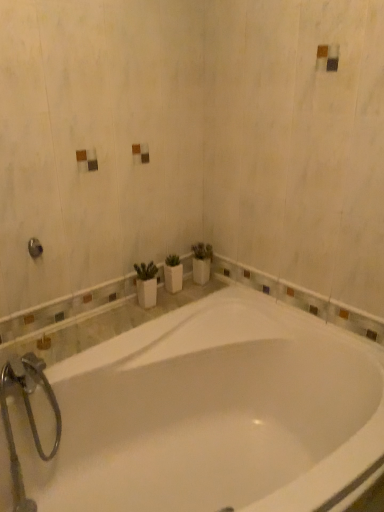
Question: Is white glossy bathtub at center taller than brushed metal shower at upper left?

Choices:
 (A) yes
 (B) no

Answer: (A)

Question: Is white glossy bathtub at center smaller than brushed metal shower at upper left?

Choices:
 (A) no
 (B) yes

Answer: (A)

Question: Is white glossy bathtub at center looking in the opposite direction of brushed metal shower at upper left?

Choices:
 (A) yes
 (B) no

Answer: (B)

Question: Is white glossy bathtub at center closer to the viewer compared to brushed metal shower at upper left?

Choices:
 (A) no
 (B) yes

Answer: (B)

Question: Does white glossy bathtub at center have a greater width compared to brushed metal shower at upper left?

Choices:
 (A) yes
 (B) no

Answer: (A)

Question: From a real-world perspective, is white glossy bathtub at center over brushed metal shower at upper left?

Choices:
 (A) yes
 (B) no

Answer: (B)

Question: From a real-world perspective, is brushed metal shower at upper left positioned over white glossy bathtub at center based on gravity?

Choices:
 (A) yes
 (B) no

Answer: (A)

Question: From the image's perspective, would you say brushed metal shower at upper left is shown under white glossy bathtub at center?

Choices:
 (A) no
 (B) yes

Answer: (A)

Question: Is brushed metal shower at upper left smaller than white glossy bathtub at center?

Choices:
 (A) no
 (B) yes

Answer: (B)

Question: Is brushed metal shower at upper left facing away from white glossy bathtub at center?

Choices:
 (A) yes
 (B) no

Answer: (B)

Question: Is brushed metal shower at upper left next to white glossy bathtub at center and touching it?

Choices:
 (A) no
 (B) yes

Answer: (A)

Question: From the image's perspective, does brushed metal shower at upper left appear higher than white glossy bathtub at center?

Choices:
 (A) yes
 (B) no

Answer: (A)

Question: From their relative heights in the image, would you say brushed metal shower at upper left is taller or shorter than white glossy bathtub at center?

Choices:
 (A) short
 (B) tall

Answer: (A)